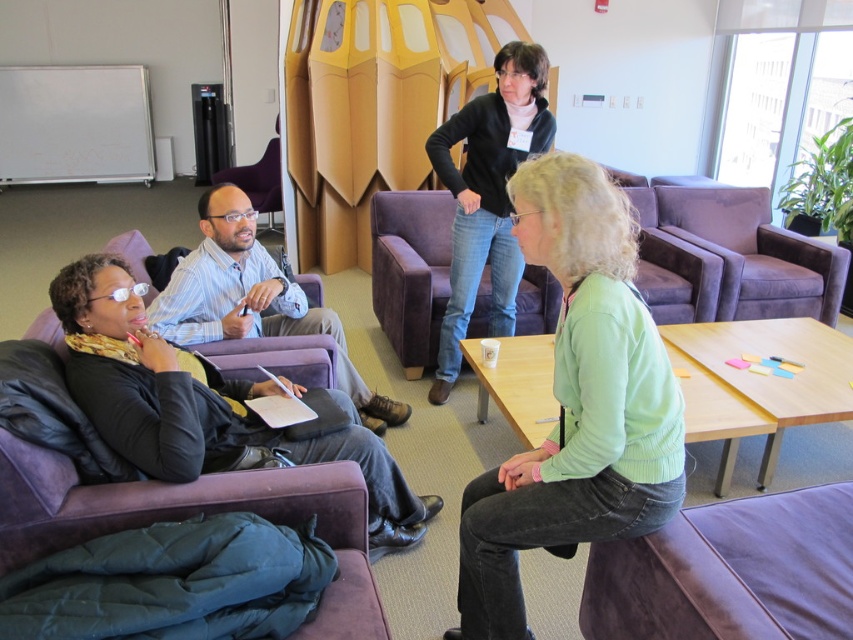
Question: Which point is closer to the camera?

Choices:
 (A) jeans at center
 (B) purple suede couch at lower right

Answer: (B)

Question: Which point is closer to the camera taking this photo?

Choices:
 (A) (281, 230)
 (B) (462, 241)

Answer: (B)

Question: Does black matte jacket at lower left have a lesser width compared to matte purple armchair at center?

Choices:
 (A) yes
 (B) no

Answer: (B)

Question: Does purple suede couch at lower right have a lesser width compared to matte black shirt at center?

Choices:
 (A) no
 (B) yes

Answer: (B)

Question: Is jeans at center smaller than matte purple armchair at center?

Choices:
 (A) no
 (B) yes

Answer: (A)

Question: Which of the following is the closest to the observer?

Choices:
 (A) jeans at center
 (B) green knitwear at center
 (C) black matte jacket at lower left
 (D) purple suede couch at lower right

Answer: (D)